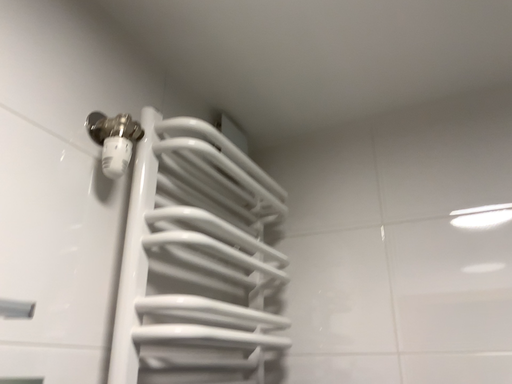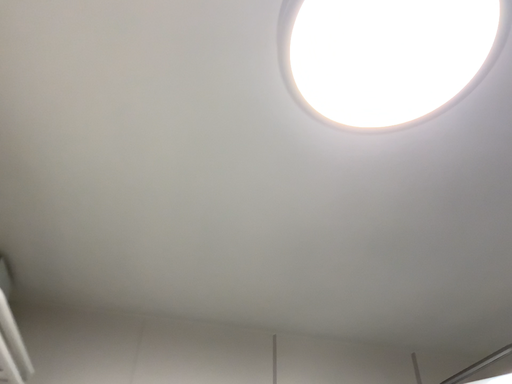
Question: How did the camera likely rotate when shooting the video?

Choices:
 (A) rotated right
 (B) rotated left

Answer: (A)